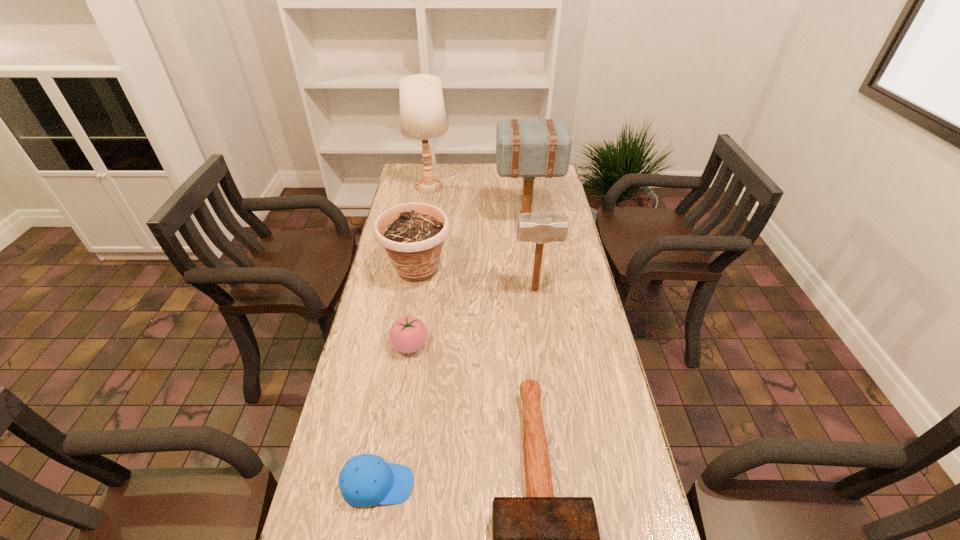
Find the location of a particular element. vacant position located on the right of the lamp is located at coordinates (530, 186).

Locate an element on the screen. The height and width of the screenshot is (540, 960). free space located on the striking surface of the tallest mallet is located at coordinates (463, 219).

Identify the location of vacant region located 0.230m on the striking surface of the tallest mallet. (439, 219).

Identify the location of vacant space located on the striking surface of the tallest mallet. (441, 219).

You are a GUI agent. You are given a task and a screenshot of the screen. Output one action in this format:
    pyautogui.click(x=<x>, y=<y>)
    Task: Click on the vacant region located 0.110m on the striking face of the second farthest mallet
    The width and height of the screenshot is (960, 540).
    Given the screenshot: What is the action you would take?
    pyautogui.click(x=480, y=289)

The height and width of the screenshot is (540, 960). In order to click on blank space located on the striking face of the second farthest mallet in this screenshot , I will do `click(412, 289)`.

This screenshot has height=540, width=960. In order to click on free space located 0.320m on the striking face of the second farthest mallet in this screenshot , I will do `click(418, 289)`.

Locate an element on the screen. This screenshot has width=960, height=540. blank space located on the front of the flowerpot is located at coordinates (405, 343).

The width and height of the screenshot is (960, 540). I want to click on free spot located 0.400m on the right of the third shortest object, so point(564,345).

Image resolution: width=960 pixels, height=540 pixels. In order to click on blank area located 0.130m on the front-facing side of the cap in this screenshot , I will do click(470, 484).